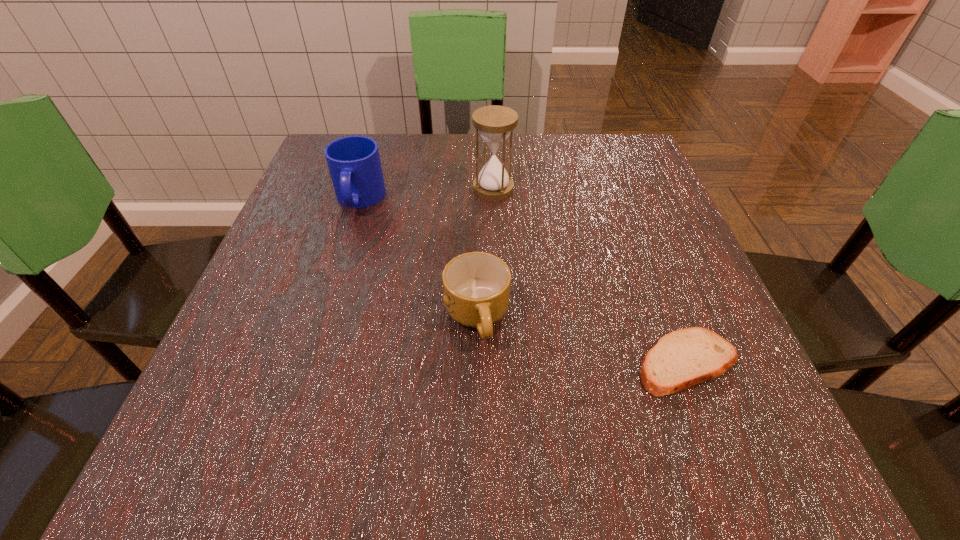
At what (x,y) coordinates should I click in order to perform the action: click on empty location between the hourglass and the taller mug. Please return your answer as a coordinate pair (x, y). Looking at the image, I should click on (426, 194).

Locate which object ranks third in proximity to the hourglass. Please provide its 2D coordinates. Your answer should be formatted as a tuple, i.e. [(x, y)], where the tuple contains the x and y coordinates of a point satisfying the conditions above.

[(681, 359)]

Point out which object is positioned as the nearest to the tallest object. Please provide its 2D coordinates. Your answer should be formatted as a tuple, i.e. [(x, y)], where the tuple contains the x and y coordinates of a point satisfying the conditions above.

[(354, 164)]

What are the coordinates of `free spot that satisfies the following two spatial constraints: 1. on the side with the handle of the rightmost object; 2. on the right side of the nearer mug` in the screenshot? It's located at (476, 363).

What are the coordinates of `free location that satisfies the following two spatial constraints: 1. on the side with the handle of the shortest object; 2. on the left side of the third tallest object` in the screenshot? It's located at (476, 363).

In order to click on free location that satisfies the following two spatial constraints: 1. on the side with the handle of the third shortest object; 2. on the right side of the pita bread in this screenshot , I will do `click(308, 363)`.

Where is `vacant area that satisfies the following two spatial constraints: 1. on the front side of the rightmost object; 2. on the left side of the hourglass`? This screenshot has width=960, height=540. vacant area that satisfies the following two spatial constraints: 1. on the front side of the rightmost object; 2. on the left side of the hourglass is located at coordinates (499, 363).

The height and width of the screenshot is (540, 960). I want to click on vacant region that satisfies the following two spatial constraints: 1. on the side with the handle of the shorter mug; 2. on the left side of the pita bread, so click(476, 363).

In order to click on vacant area in the image that satisfies the following two spatial constraints: 1. on the side with the handle of the left mug; 2. on the right side of the shortest object in this screenshot , I will do `click(308, 363)`.